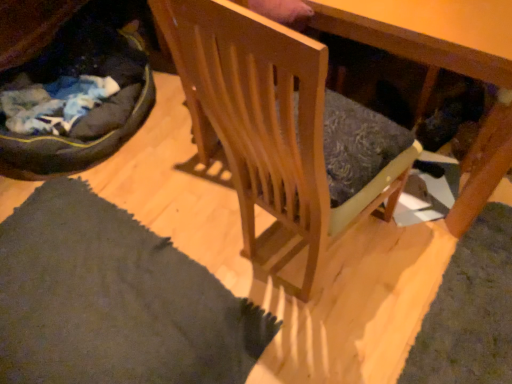
Question: From a real-world perspective, is dark gray fabric cat bed at lower left above or below wooden chair at center?

Choices:
 (A) above
 (B) below

Answer: (B)

Question: Does point (9, 172) appear closer or farther from the camera than point (294, 152)?

Choices:
 (A) closer
 (B) farther

Answer: (B)

Question: Considering the positions of dark gray fabric cat bed at lower left and wooden chair at center in the image, is dark gray fabric cat bed at lower left wider or thinner than wooden chair at center?

Choices:
 (A) wide
 (B) thin

Answer: (A)

Question: Do you think wooden chair at center is within dark gray fabric cat bed at lower left, or outside of it?

Choices:
 (A) inside
 (B) outside

Answer: (B)

Question: Relative to dark gray fabric cat bed at lower left, is wooden chair at center in front or behind?

Choices:
 (A) behind
 (B) front

Answer: (B)

Question: From a real-world perspective, is wooden chair at center physically located above or below dark gray fabric cat bed at lower left?

Choices:
 (A) above
 (B) below

Answer: (A)

Question: Considering the positions of wooden chair at center and dark gray fabric cat bed at lower left in the image, is wooden chair at center wider or thinner than dark gray fabric cat bed at lower left?

Choices:
 (A) thin
 (B) wide

Answer: (A)